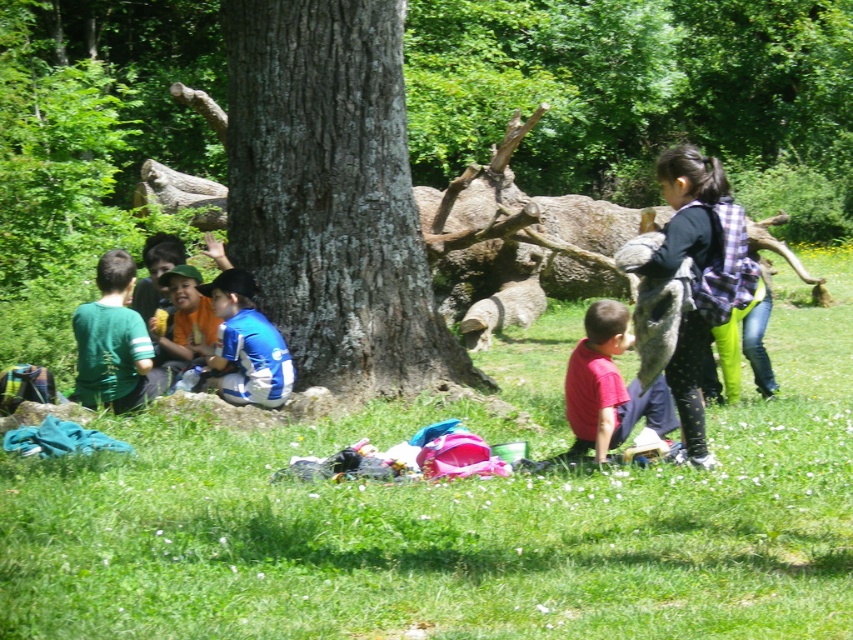
Is smooth bark tree at center to the right of red matte shirt at lower center from the viewer's perspective?

In fact, smooth bark tree at center is to the left of red matte shirt at lower center.

Is point (231, 60) positioned in front of point (583, 442)?

No, (231, 60) is behind (583, 442).

Is point (409, 192) closer to camera compared to point (625, 406)?

That is False.

Locate an element on the screen. This screenshot has height=640, width=853. smooth bark tree at center is located at coordinates (332, 195).

Is smooth bark tree at center to the right of plaid fabric backpack at right from the viewer's perspective?

No, smooth bark tree at center is not to the right of plaid fabric backpack at right.

Does smooth bark tree at center have a greater width compared to plaid fabric backpack at right?

No.

What do you see at coordinates (332, 195) in the screenshot? This screenshot has width=853, height=640. I see `smooth bark tree at center` at bounding box center [332, 195].

Find the location of a particular element. smooth bark tree at center is located at coordinates (332, 195).

Can you confirm if smooth bark tree at center is taller than blue jersey at center?

Yes.

Does point (281, 76) come closer to viewer compared to point (257, 320)?

No, (281, 76) is behind (257, 320).

Does point (242, 109) lie in front of point (229, 278)?

No, (242, 109) is behind (229, 278).

The height and width of the screenshot is (640, 853). In order to click on smooth bark tree at center in this screenshot , I will do `click(332, 195)`.